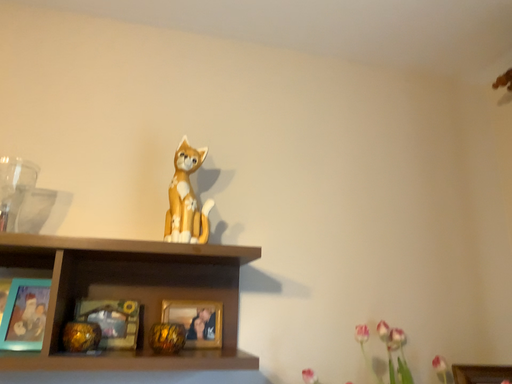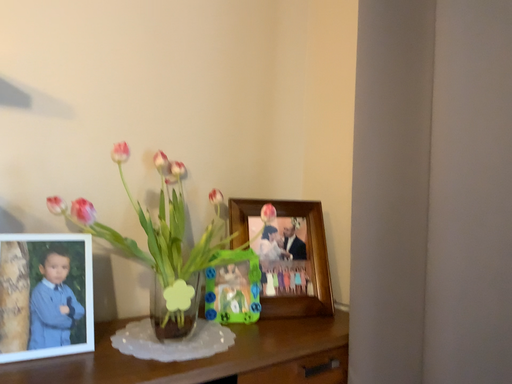
Question: How did the camera likely rotate when shooting the video?

Choices:
 (A) rotated upward
 (B) rotated downward

Answer: (B)